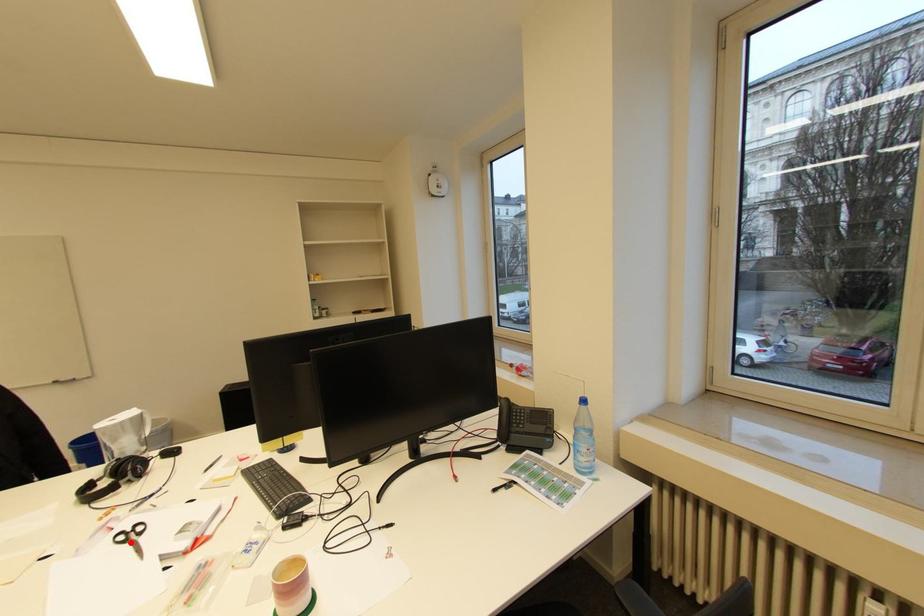
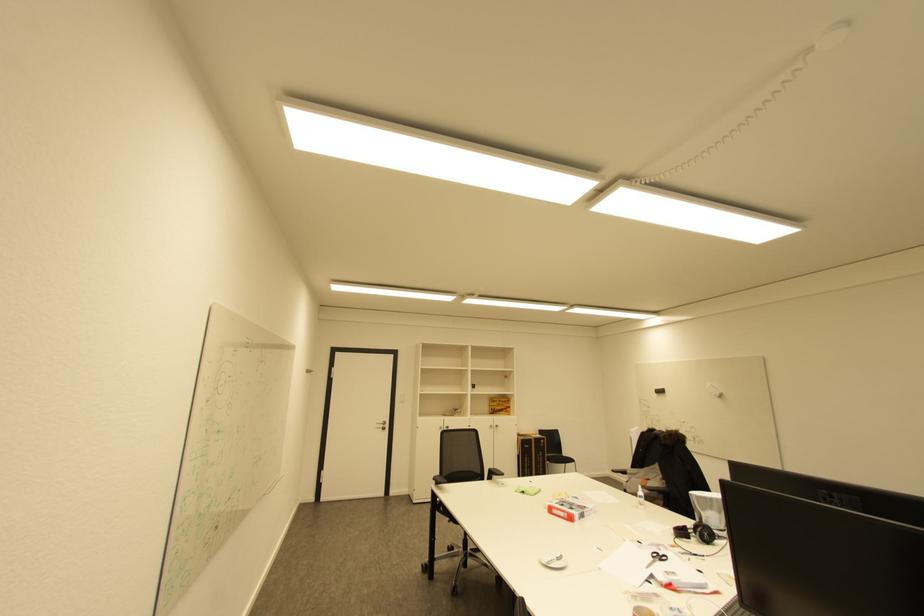
Where in the second image is the point corresponding to the highlighted location from the first image?

(659, 557)